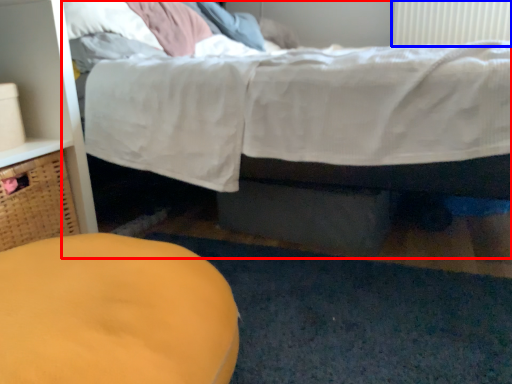
Question: Which object is further to the camera taking this photo, bed (highlighted by a red box) or radiator (highlighted by a blue box)?

Choices:
 (A) bed
 (B) radiator

Answer: (B)